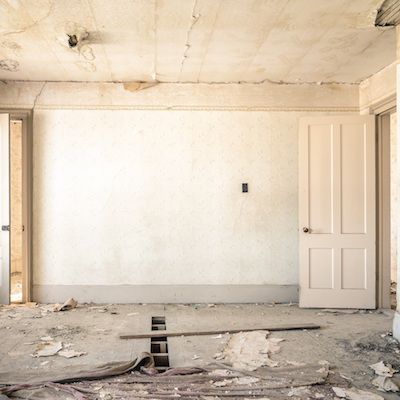
Image resolution: width=400 pixels, height=400 pixels. In order to click on loose board in this screenshot , I will do `click(234, 328)`.